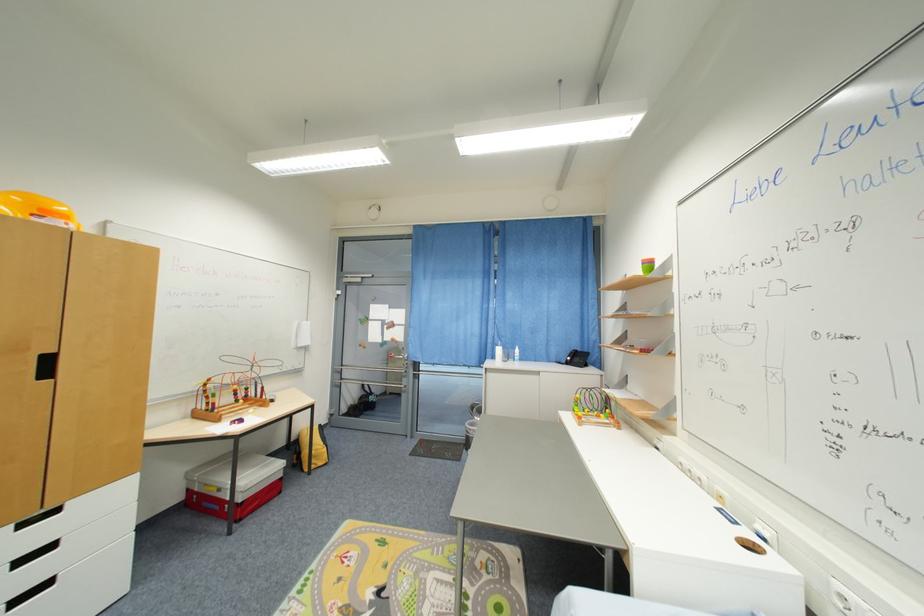
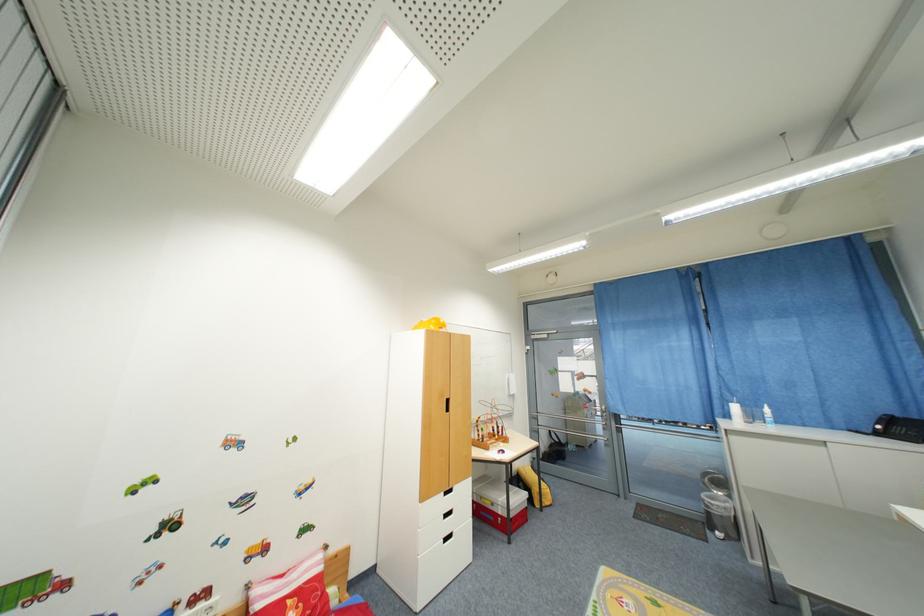
In the second image, find the point that corresponds to [505,352] in the first image.

(740, 410)